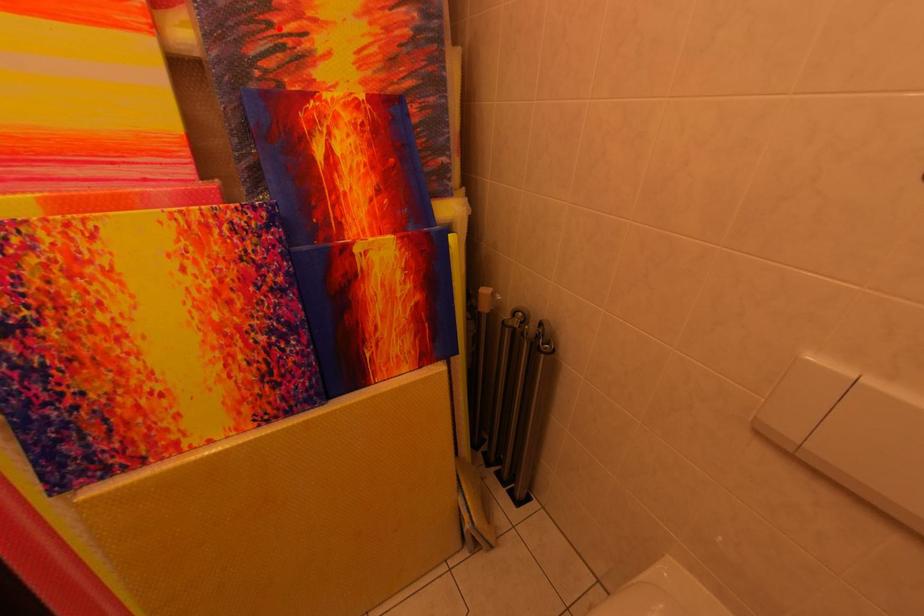
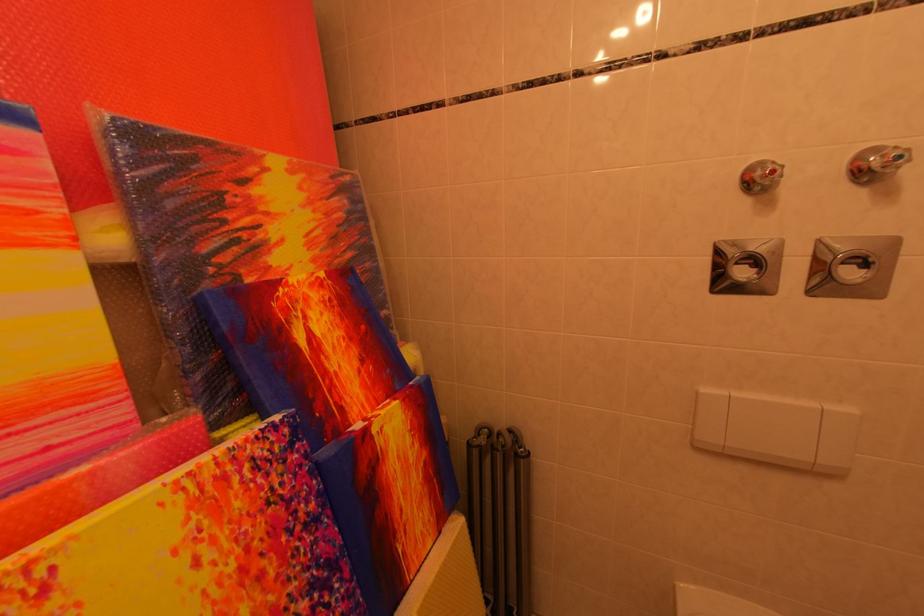
Find the pixel in the second image that matches the highlighted location in the first image.

(233, 225)